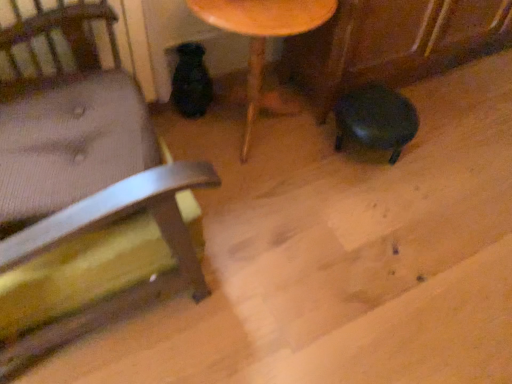
Describe the element at coordinates (85, 175) in the screenshot. I see `wooden chair at left` at that location.

Describe the element at coordinates (262, 33) in the screenshot. I see `wooden table at center` at that location.

What do you see at coordinates (375, 119) in the screenshot?
I see `matte black stool at lower right` at bounding box center [375, 119].

In order to click on wooden chair at left in this screenshot , I will do click(85, 175).

From the image's perspective, is wooden table at center located above or below wooden chair at left?

Based on their image positions, wooden table at center is located above wooden chair at left.

Is wooden table at center positioned beyond the bounds of wooden chair at left?

Indeed, wooden table at center is completely outside wooden chair at left.

Does wooden table at center come in front of wooden chair at left?

No, it is behind wooden chair at left.

Is point (111, 301) less distant than point (377, 105)?

That is True.

Considering the sizes of wooden chair at left and matte black stool at lower right in the image, is wooden chair at left taller or shorter than matte black stool at lower right?

wooden chair at left is taller than matte black stool at lower right.

From the image's perspective, is wooden chair at left located above matte black stool at lower right?

Actually, wooden chair at left appears below matte black stool at lower right in the image.

Is the position of wooden chair at left more distant than that of matte black stool at lower right?

No, wooden chair at left is closer to the viewer.

From the image's perspective, does wooden table at center appear lower than matte black stool at lower right?

Incorrect, from the image's perspective, wooden table at center is higher than matte black stool at lower right.

Is wooden table at center oriented away from matte black stool at lower right?

No, wooden table at center's orientation is not away from matte black stool at lower right.

Is matte black stool at lower right completely or partially inside wooden table at center?

No, matte black stool at lower right is located outside of wooden table at center.

Based on the photo, measure the distance between wooden table at center and matte black stool at lower right.

wooden table at center and matte black stool at lower right are 19.48 inches apart from each other.

Which of these two, matte black stool at lower right or wooden table at center, is thinner?

Thinner between the two is matte black stool at lower right.

How different are the orientations of matte black stool at lower right and wooden table at center in degrees?

The angle between the facing direction of matte black stool at lower right and the facing direction of wooden table at center is 5.14 degrees.

Is matte black stool at lower right with wooden table at center?

matte black stool at lower right and wooden table at center are clearly separated.

From their relative heights in the image, would you say matte black stool at lower right is taller or shorter than wooden table at center?

In the image, matte black stool at lower right appears to be shorter than wooden table at center.

Which of these two, matte black stool at lower right or wooden chair at left, is smaller?

Smaller between the two is matte black stool at lower right.

Which object is positioned more to the right, matte black stool at lower right or wooden chair at left?

From the viewer's perspective, matte black stool at lower right appears more on the right side.

Is matte black stool at lower right far from wooden chair at left?

No, matte black stool at lower right is not far away from wooden chair at left.

Would you say wooden chair at left is outside wooden table at center?

Yes.

The height and width of the screenshot is (384, 512). In order to click on table on the right of the wooden chair at left in this screenshot , I will do `click(262, 33)`.

Based on the photo, from a real-world perspective, is wooden chair at left above or below wooden table at center?

wooden chair at left is situated higher than wooden table at center in the real world.

At what (x,y) coordinates should I click in order to perform the action: click on table behind the wooden chair at left. Please return your answer as a coordinate pair (x, y). This screenshot has width=512, height=384. Looking at the image, I should click on (262, 33).

Identify the location of bar stool above the wooden chair at left (from the image's perspective). The height and width of the screenshot is (384, 512). (375, 119).

From the image, which object appears to be farther from wooden table at center, matte black stool at lower right or wooden chair at left?

The object further to wooden table at center is wooden chair at left.

Looking at the image, which one is located further to wooden chair at left, matte black stool at lower right or wooden table at center?

Based on the image, matte black stool at lower right appears to be further to wooden chair at left.

Looking at this image, based on their spatial positions, is wooden chair at left or wooden table at center closer to matte black stool at lower right?

Among the two, wooden table at center is located nearer to matte black stool at lower right.

Based on their spatial positions, is wooden table at center or wooden chair at left closer to matte black stool at lower right?

wooden table at center lies closer to matte black stool at lower right than the other object.

Which object lies further to the anchor point wooden table at center, wooden chair at left or matte black stool at lower right?

Based on the image, wooden chair at left appears to be further to wooden table at center.

When comparing their distances from wooden chair at left, does wooden table at center or matte black stool at lower right seem further?

Based on the image, matte black stool at lower right appears to be further to wooden chair at left.

Locate an element on the screen. table positioned between wooden chair at left and matte black stool at lower right from near to far is located at coordinates (262, 33).